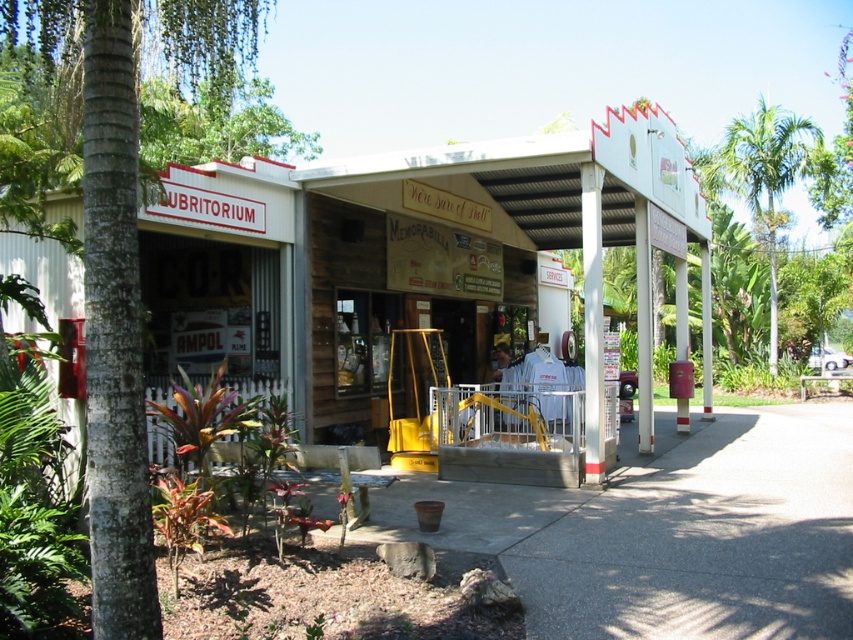
You are standing outside the UBRITORIUM shop and want to take a photo of the wooden signboard at center and the green leafy palm tree at upper right. Which object should you focus on first to ensure both are in the frame?

You should focus on the wooden signboard at center first because it is in front of the green leafy palm tree at upper right, so positioning the camera to include the closer object ensures both are visible in the photo.

You are a customer standing outside the UBRITORIUM shop. You notice a wooden signboard at center and a green leafy palm tree at upper right. Which object is wider?

The wooden signboard at center is wider than the green leafy palm tree at upper right.

You are a customer entering the UBRITORIUM shop. As you look up, you notice the wooden signboard at center and the green leafy palm tree at upper right. Which object is located higher up in the image?

The green leafy palm tree at upper right is located higher up in the image because it is positioned above the wooden signboard at center.